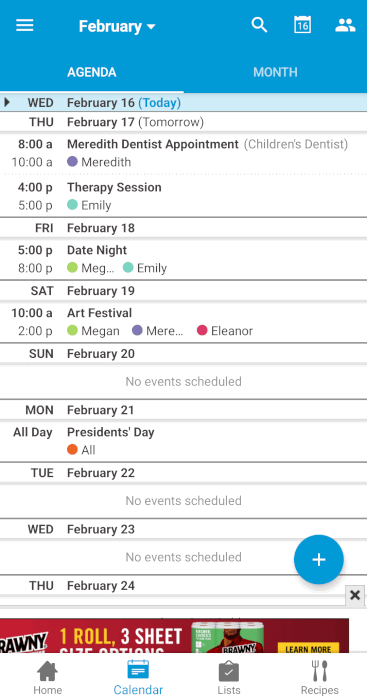
This screenshot has width=367, height=700. Identify the location of papertowels. (236, 635).